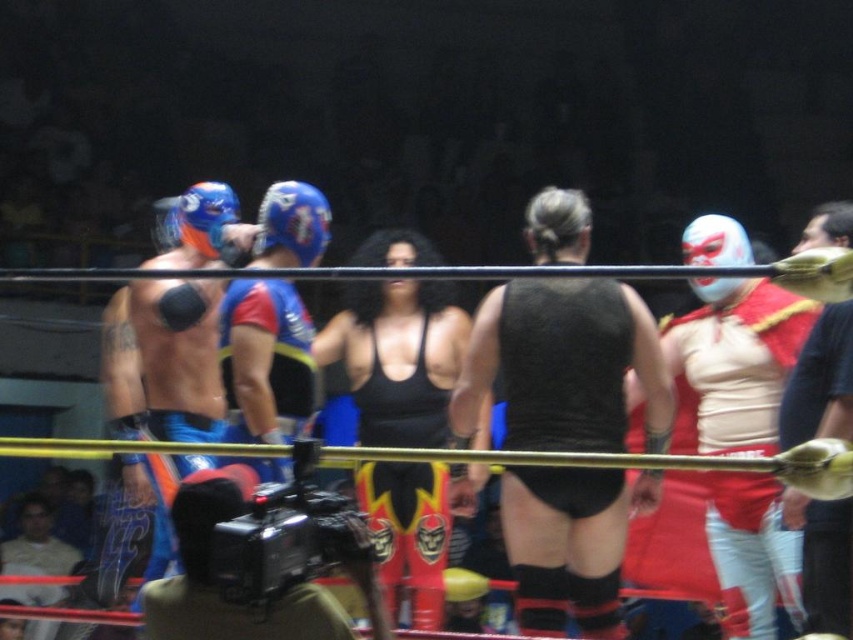
Question: Does black matte camera at lower left have a lesser width compared to matte black wrestling mask at lower left?

Choices:
 (A) yes
 (B) no

Answer: (A)

Question: Is matte white mask at center below matte black wrestling mask at lower left?

Choices:
 (A) yes
 (B) no

Answer: (B)

Question: Observing the image, what is the correct spatial positioning of black matte vest at center in reference to black matte camera at lower left?

Choices:
 (A) below
 (B) above

Answer: (B)

Question: Which object appears farthest from the camera in this image?

Choices:
 (A) matte black wrestling mask at lower left
 (B) black matte camera at lower left
 (C) shiny blue helmet at center
 (D) black matte vest at center

Answer: (A)

Question: Considering the real-world distances, which object is farthest from the black matte camera at lower left?

Choices:
 (A) black matte vest at center
 (B) matte black wrestling mask at lower left
 (C) matte white mask at center

Answer: (B)

Question: Which object is closer to the camera taking this photo?

Choices:
 (A) shiny blue helmet at center
 (B) black matte camera at lower left
 (C) black matte vest at center

Answer: (B)